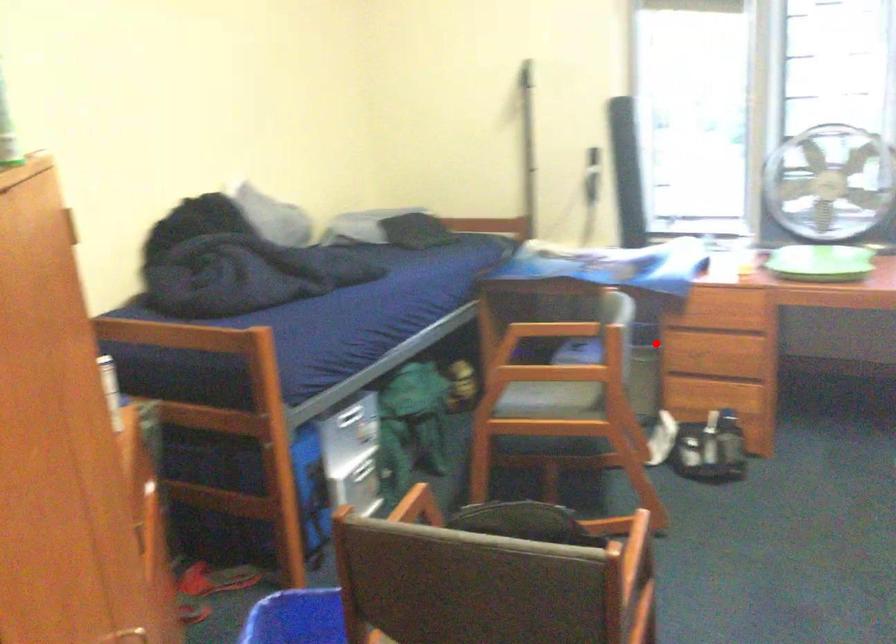
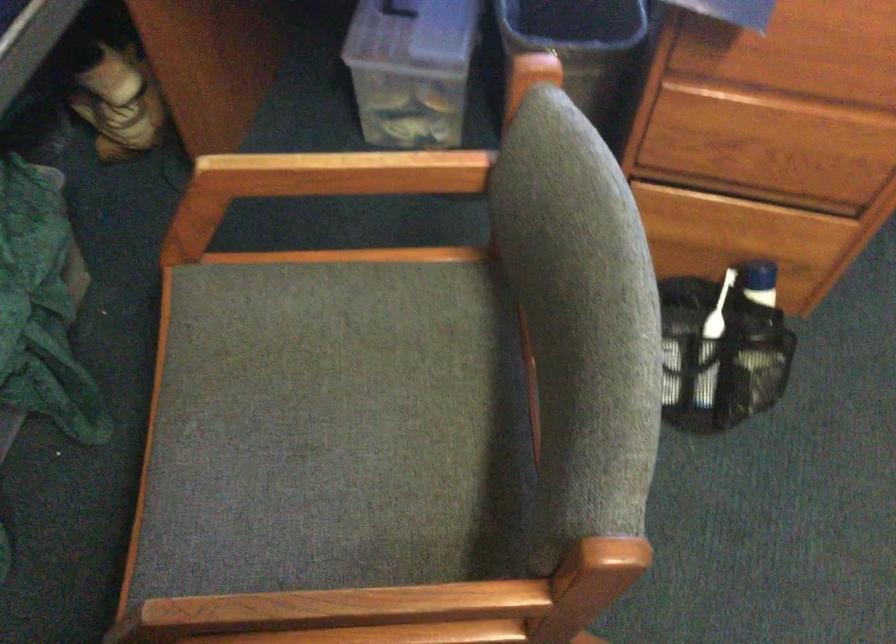
Question: I am providing you with two images of the same scene from different viewpoints. A red point is shown in image1. For the corresponding object point in image2, is it positioned nearer or farther from the camera?

Choices:
 (A) Nearer
 (B) Farther

Answer: (A)